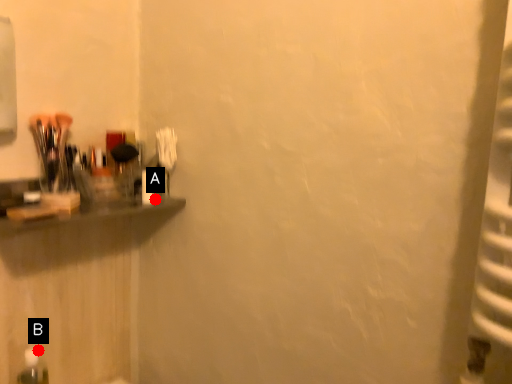
Question: Two points are circled on the image, labeled by A and B beside each circle. Which point is farther from the camera taking this photo?

Choices:
 (A) A is further
 (B) B is further

Answer: (A)